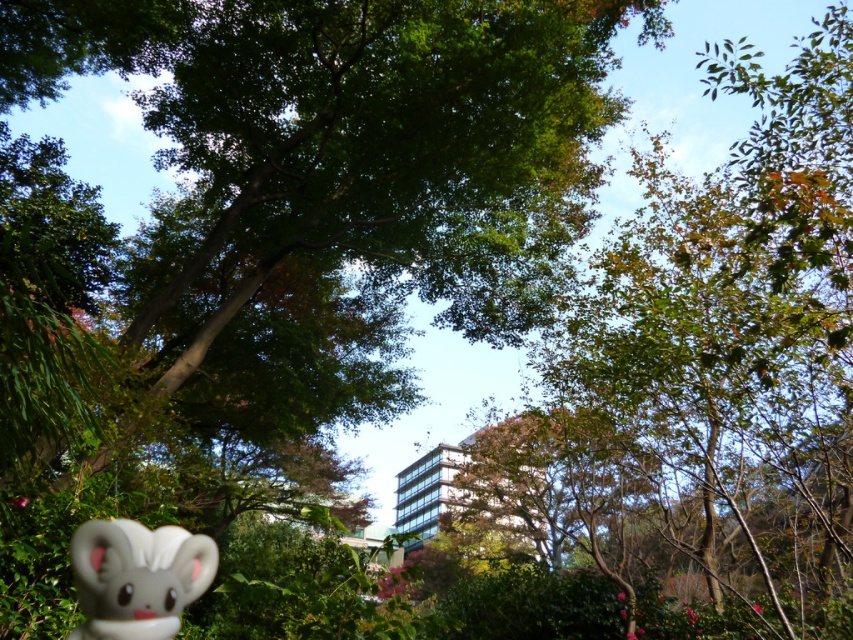
Question: Which point is closer to the camera?

Choices:
 (A) (132, 632)
 (B) (520, 172)

Answer: (A)

Question: Does green leafy tree at center have a larger size compared to white matte plush toy at lower left?

Choices:
 (A) yes
 (B) no

Answer: (A)

Question: Is green leafy tree at center wider than white matte plush toy at lower left?

Choices:
 (A) yes
 (B) no

Answer: (A)

Question: Which of the following is the farthest from the observer?

Choices:
 (A) (119, 618)
 (B) (567, 35)

Answer: (B)

Question: Does green leafy tree at center have a smaller size compared to white matte plush toy at lower left?

Choices:
 (A) no
 (B) yes

Answer: (A)